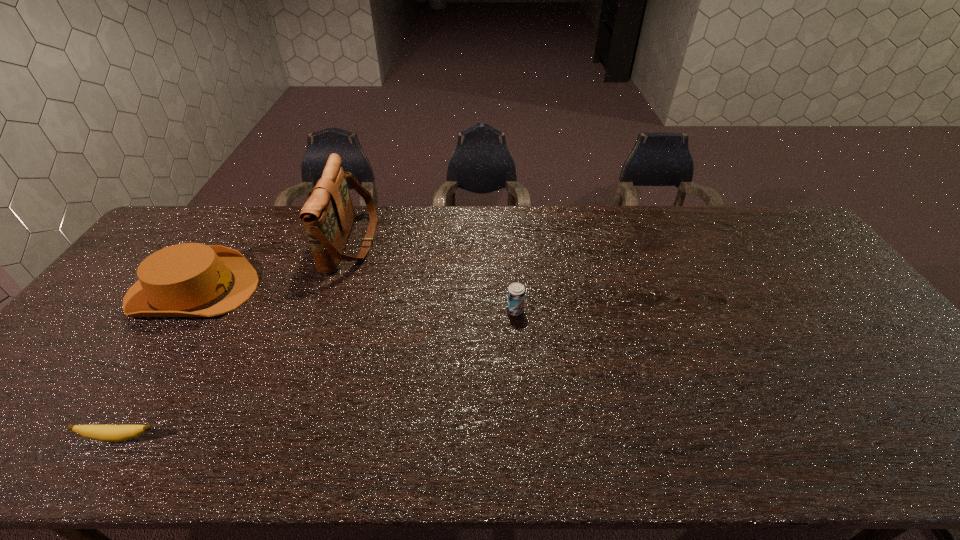
What are the coordinates of `free spot that satisfies the following two spatial constraints: 1. on the front-facing side of the shoulder bag; 2. on the front side of the shortest object` in the screenshot? It's located at (284, 437).

At what (x,y) coordinates should I click in order to perform the action: click on vacant area that satisfies the following two spatial constraints: 1. on the front-facing side of the shoulder bag; 2. on the back side of the beer can. Please return your answer as a coordinate pair (x, y). Image resolution: width=960 pixels, height=540 pixels. Looking at the image, I should click on (327, 310).

The image size is (960, 540). Find the location of `free space that satisfies the following two spatial constraints: 1. on the front-facing side of the cowboy hat; 2. on the back side of the rightmost object`. free space that satisfies the following two spatial constraints: 1. on the front-facing side of the cowboy hat; 2. on the back side of the rightmost object is located at coordinates (179, 310).

You are a GUI agent. You are given a task and a screenshot of the screen. Output one action in this format:
    pyautogui.click(x=<x>, y=<y>)
    Task: Click on the free location that satisfies the following two spatial constraints: 1. on the front-facing side of the cowboy hat; 2. on the left side of the banana
    
    Given the screenshot: What is the action you would take?
    pyautogui.click(x=93, y=437)

I want to click on vacant space that satisfies the following two spatial constraints: 1. on the front-facing side of the cowboy hat; 2. on the left side of the rightmost object, so (x=179, y=310).

The width and height of the screenshot is (960, 540). Identify the location of vacant space that satisfies the following two spatial constraints: 1. on the front-facing side of the cowboy hat; 2. on the left side of the beer can. (179, 310).

Where is `vacant area that satisfies the following two spatial constraints: 1. on the front-facing side of the tallest object; 2. on the front side of the nearest object`? The width and height of the screenshot is (960, 540). vacant area that satisfies the following two spatial constraints: 1. on the front-facing side of the tallest object; 2. on the front side of the nearest object is located at coordinates (284, 437).